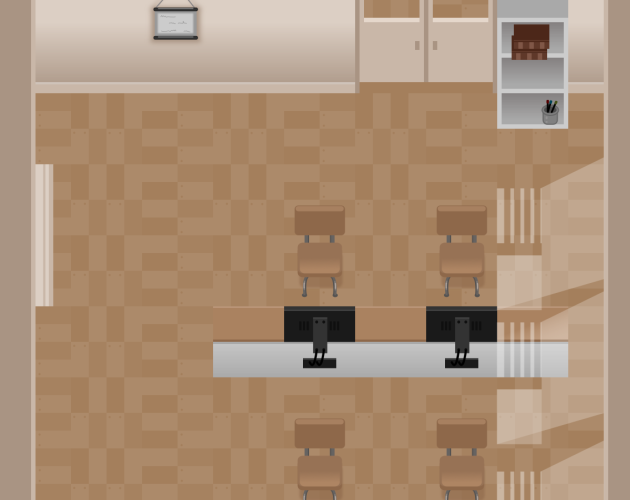
Locate an element on the screen. books is located at coordinates (524, 42), (532, 57).